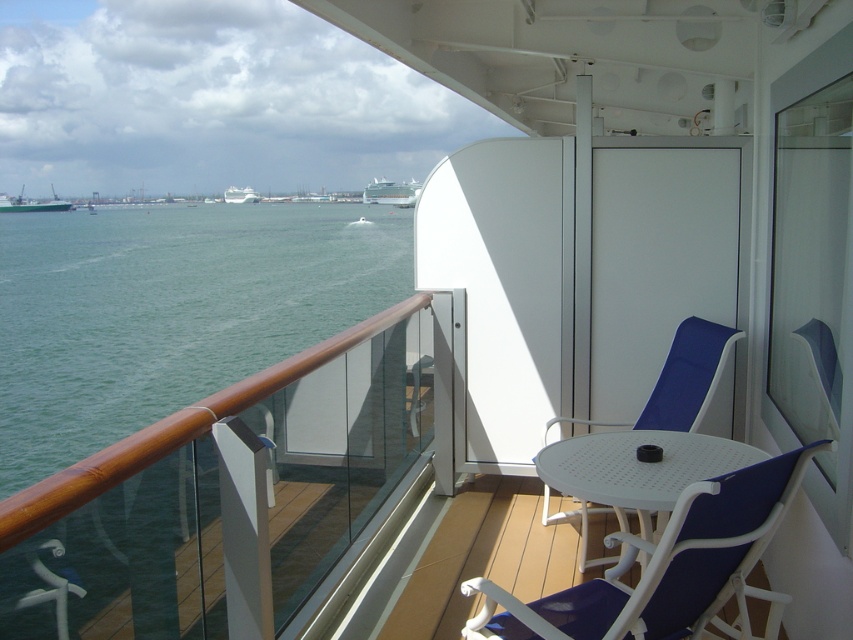
Question: Is white glossy cruise ship at upper center to the left of green matte cargo ship at left from the viewer's perspective?

Choices:
 (A) no
 (B) yes

Answer: (A)

Question: Based on their relative distances, which object is farther from the green matte cargo ship at left?

Choices:
 (A) white metal table at center
 (B) white glossy cruise ship at upper center
 (C) white plastic beach chair at center

Answer: (C)

Question: Does green water at lower left lie in front of green matte cargo ship at left?

Choices:
 (A) yes
 (B) no

Answer: (A)

Question: Does green water at lower left appear on the right side of white metal table at center?

Choices:
 (A) yes
 (B) no

Answer: (B)

Question: Based on their relative distances, which object is farther from the green matte cargo ship at left?

Choices:
 (A) white plastic beach chair at center
 (B) white metal table at center
 (C) green water at lower left

Answer: (A)

Question: Which point appears farthest from the camera in this image?

Choices:
 (A) (583, 449)
 (B) (386, 195)

Answer: (B)